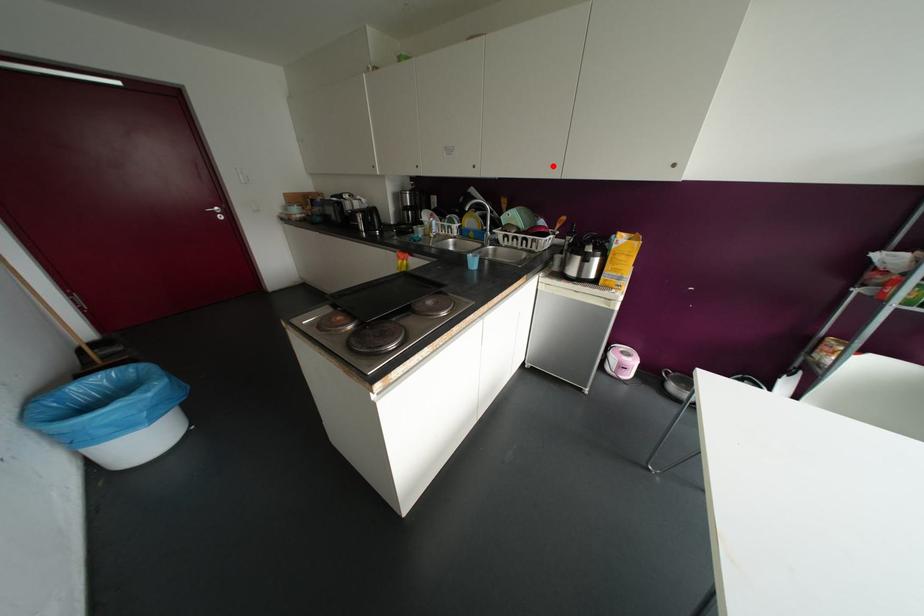
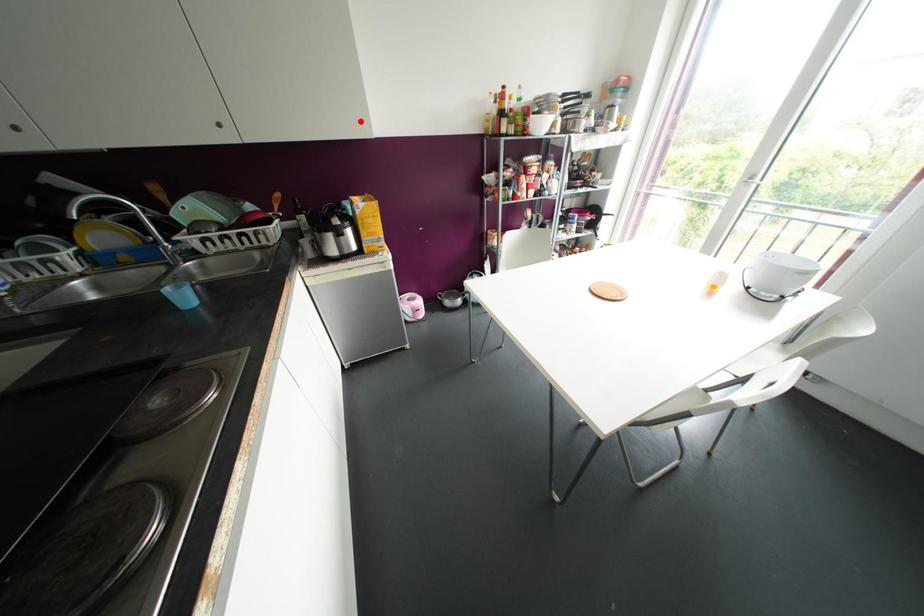
I am providing you with two images of the same scene from different viewpoints. A red point is marked on the first image and another point is marked on the second image. Does the point marked in image1 correspond to the same location as the one in image2?

No